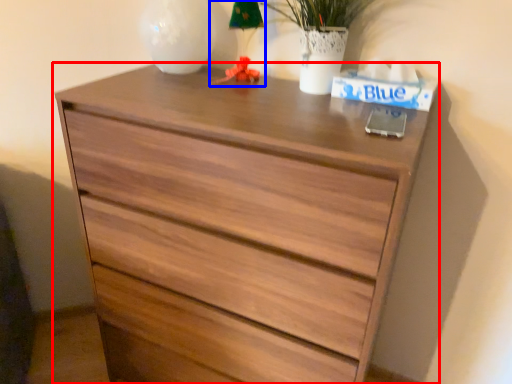
Question: Which object appears closest to the camera in this image, chest of drawers (highlighted by a red box) or table lamp (highlighted by a blue box)?

Choices:
 (A) chest of drawers
 (B) table lamp

Answer: (A)